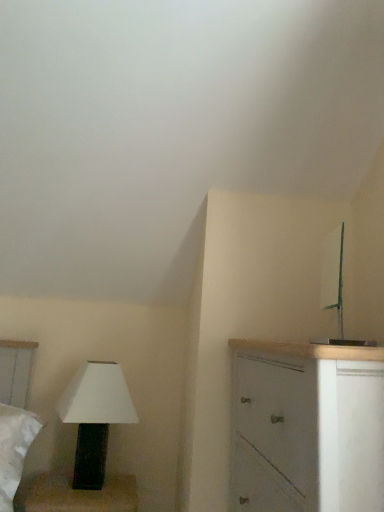
At what (x,y) coordinates should I click in order to perform the action: click on white matte lamp at lower left. Please return your answer as a coordinate pair (x, y). This screenshot has width=384, height=512. Looking at the image, I should click on (95, 417).

The width and height of the screenshot is (384, 512). Describe the element at coordinates (95, 417) in the screenshot. I see `white matte lamp at lower left` at that location.

This screenshot has width=384, height=512. What do you see at coordinates (307, 426) in the screenshot?
I see `white matte cabinet at right` at bounding box center [307, 426].

This screenshot has height=512, width=384. What are the coordinates of `white matte cabinet at right` in the screenshot? It's located at pos(307,426).

In order to click on white matte lamp at lower left in this screenshot , I will do `click(95, 417)`.

In the scene shown: Considering the relative positions of white matte lamp at lower left and white matte cabinet at right in the image provided, is white matte lamp at lower left to the left of white matte cabinet at right from the viewer's perspective?

Yes.

Which is in front, white matte lamp at lower left or white matte cabinet at right?

Positioned in front is white matte cabinet at right.

Does point (79, 413) lie in front of point (258, 404)?

No, it is behind (258, 404).

From the image's perspective, would you say white matte lamp at lower left is shown under white matte cabinet at right?

Correct, white matte lamp at lower left appears lower than white matte cabinet at right in the image.

From a real-world perspective, between white matte lamp at lower left and white matte cabinet at right, who is vertically higher?

white matte cabinet at right is physically above.

Considering the sizes of white matte lamp at lower left and white matte cabinet at right in the image, is white matte lamp at lower left wider or thinner than white matte cabinet at right?

In the image, white matte lamp at lower left appears to be more narrow than white matte cabinet at right.

Between white matte lamp at lower left and white matte cabinet at right, which one has less height?

white matte lamp at lower left.

Looking at this image, is white matte lamp at lower left bigger or smaller than white matte cabinet at right?

white matte lamp at lower left is smaller than white matte cabinet at right.

Would you say white matte lamp at lower left contains white matte cabinet at right?

No, white matte lamp at lower left does not contain white matte cabinet at right.

Consider the image. Is there a large distance between white matte lamp at lower left and white matte cabinet at right?

They are positioned close to each other.

Is white matte lamp at lower left oriented away from white matte cabinet at right?

No, white matte lamp at lower left's orientation is not away from white matte cabinet at right.

Can you tell me how much white matte lamp at lower left and white matte cabinet at right differ in facing direction?

The facing directions of white matte lamp at lower left and white matte cabinet at right are 90 degrees apart.

Identify the location of the chest of drawers in front of the white matte lamp at lower left. The width and height of the screenshot is (384, 512). (307, 426).

Can you confirm if white matte cabinet at right is positioned to the right of white matte lamp at lower left?

Yes.

Is white matte cabinet at right positioned behind white matte lamp at lower left?

No.

Is point (264, 349) less distant than point (95, 486)?

Yes, it is.

From the image's perspective, is white matte cabinet at right under white matte lamp at lower left?

No, from the image's perspective, white matte cabinet at right is not beneath white matte lamp at lower left.

From a real-world perspective, between white matte cabinet at right and white matte lamp at lower left, who is vertically lower?

From a 3D spatial view, white matte lamp at lower left is below.

Can you confirm if white matte cabinet at right is wider than white matte lamp at lower left?

Indeed, white matte cabinet at right has a greater width compared to white matte lamp at lower left.

Who is shorter, white matte cabinet at right or white matte lamp at lower left?

white matte lamp at lower left.

Looking at this image, is white matte cabinet at right bigger or smaller than white matte lamp at lower left?

In the image, white matte cabinet at right appears to be larger than white matte lamp at lower left.

Is white matte cabinet at right completely or partially outside of white matte lamp at lower left?

white matte cabinet at right lies outside white matte lamp at lower left's area.

Is white matte cabinet at right next to white matte lamp at lower left and touching it?

white matte cabinet at right and white matte lamp at lower left are clearly separated.

Could you tell me if white matte cabinet at right is facing white matte lamp at lower left?

No, white matte cabinet at right is not facing towards white matte lamp at lower left.

Measure the distance between white matte cabinet at right and white matte lamp at lower left.

white matte cabinet at right is 30.29 inches from white matte lamp at lower left.

The width and height of the screenshot is (384, 512). Identify the location of lamp that is under the white matte cabinet at right (from a real-world perspective). (95, 417).

The width and height of the screenshot is (384, 512). I want to click on lamp below the white matte cabinet at right (from a real-world perspective), so pos(95,417).

You are a GUI agent. You are given a task and a screenshot of the screen. Output one action in this format:
    pyautogui.click(x=<x>, y=<y>)
    Task: Click on the lamp located on the left of white matte cabinet at right
    Image resolution: width=384 pixels, height=512 pixels.
    Given the screenshot: What is the action you would take?
    pyautogui.click(x=95, y=417)